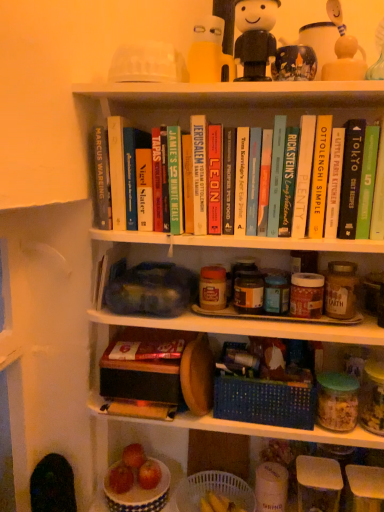
Question: Should I look upward or downward to see hardcover book at upper center, which is the tenth book in left-to-right order?

Choices:
 (A) up
 (B) down

Answer: (A)

Question: Is matte yellow figurine at upper right, which ranks as the 1th toy in right-to-left order, facing towards hardcover book at center, the 6th book positioned from the right?

Choices:
 (A) yes
 (B) no

Answer: (B)

Question: From the image's perspective, would you say matte yellow figurine at upper right, which is the 3th toy in left-to-right order, is positioned over hardcover book at center, the 6th book positioned from the right?

Choices:
 (A) no
 (B) yes

Answer: (B)

Question: Is matte yellow figurine at upper right, which ranks as the 1th toy in right-to-left order, oriented away from hardcover book at center, which ranks as the 7th book in left-to-right order?

Choices:
 (A) no
 (B) yes

Answer: (A)

Question: From a real-world perspective, does matte yellow figurine at upper right, which ranks as the 1th toy in right-to-left order, stand above hardcover book at center, which ranks as the 7th book in left-to-right order?

Choices:
 (A) yes
 (B) no

Answer: (A)

Question: Can you confirm if matte yellow figurine at upper right, which ranks as the 1th toy in right-to-left order, is thinner than hardcover book at center, the 6th book positioned from the right?

Choices:
 (A) yes
 (B) no

Answer: (A)

Question: From the image's perspective, is matte yellow figurine at upper right, which ranks as the 1th toy in right-to-left order, under hardcover book at center, the 6th book positioned from the right?

Choices:
 (A) yes
 (B) no

Answer: (B)

Question: Considering the relative sizes of red matte apple at lower center, the 2th apple viewed from the left, and blue woven basket at center, the 2th basket ordered from the bottom, in the image provided, is red matte apple at lower center, the 2th apple viewed from the left, shorter than blue woven basket at center, the 2th basket ordered from the bottom,?

Choices:
 (A) no
 (B) yes

Answer: (B)

Question: Is red matte apple at lower center, the 2th apple viewed from the left, thinner than blue woven basket at center, the 1th basket from the top?

Choices:
 (A) no
 (B) yes

Answer: (B)

Question: Is red matte apple at lower center, the 2th apple viewed from the left, facing away from blue woven basket at center, the 1th basket from the top?

Choices:
 (A) yes
 (B) no

Answer: (B)

Question: Does red matte apple at lower center, which ranks as the 2th apple in right-to-left order, have a smaller size compared to blue woven basket at center, the 2th basket ordered from the bottom?

Choices:
 (A) yes
 (B) no

Answer: (A)

Question: From the image's perspective, is red matte apple at lower center, the 2th apple viewed from the left, on blue woven basket at center, the 2th basket ordered from the bottom?

Choices:
 (A) yes
 (B) no

Answer: (B)

Question: Can you confirm if red matte apple at lower center, the 2th apple viewed from the left, is wider than blue woven basket at center, the 1th basket from the top?

Choices:
 (A) no
 (B) yes

Answer: (A)

Question: Is hardcover book at center, arranged as the 5th book when viewed from the left, wider than red matte apple at lower center, the 2th apple viewed from the left?

Choices:
 (A) no
 (B) yes

Answer: (B)